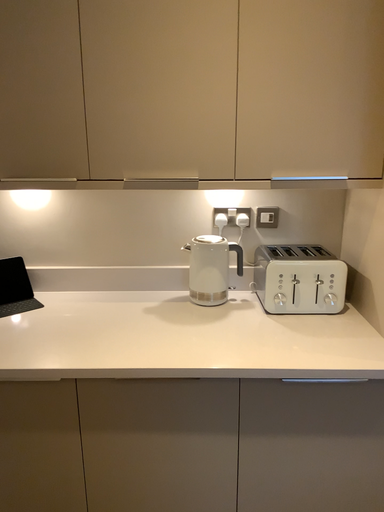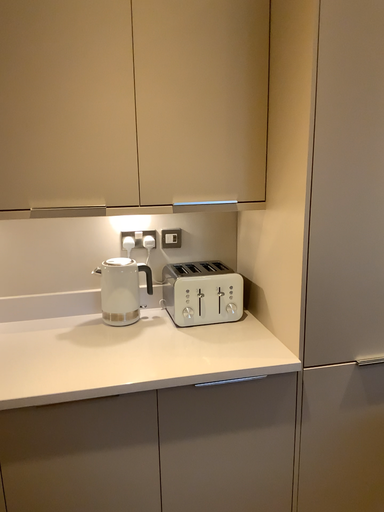
Question: Which way did the camera rotate in the video?

Choices:
 (A) rotated right
 (B) rotated left

Answer: (A)